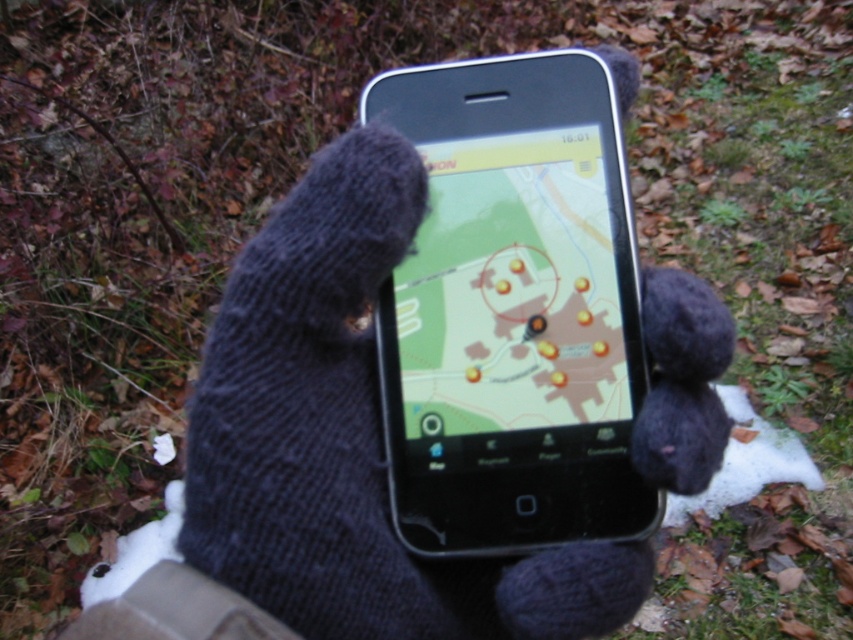
You are holding a smartphone with a map displayed. The map has a point labeled as point (461, 406). If you want to take a photo of this point using your phone camera, will the point be visible in the photo?

The point (461, 406) is 15.40 inches away from the camera. Since the camera can capture objects within its field of view and the point is at a distance, it will likely be visible in the photo as long as the camera is pointed towards it.

Looking at this image, you are using the smartphone to navigate and see two points on the map displayed on the screen. The points are labeled as point 1 at coordinates point [514,106] and point 2 at coordinates point [454,589]. Based on their positions on the screen, which point is closer to the camera?

Point [514,106] is closer to the camera than point [454,589].